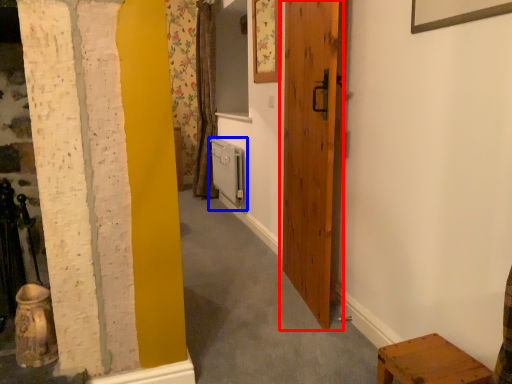
Question: Which object appears closest to the camera in this image, door (highlighted by a red box) or radiator (highlighted by a blue box)?

Choices:
 (A) door
 (B) radiator

Answer: (A)